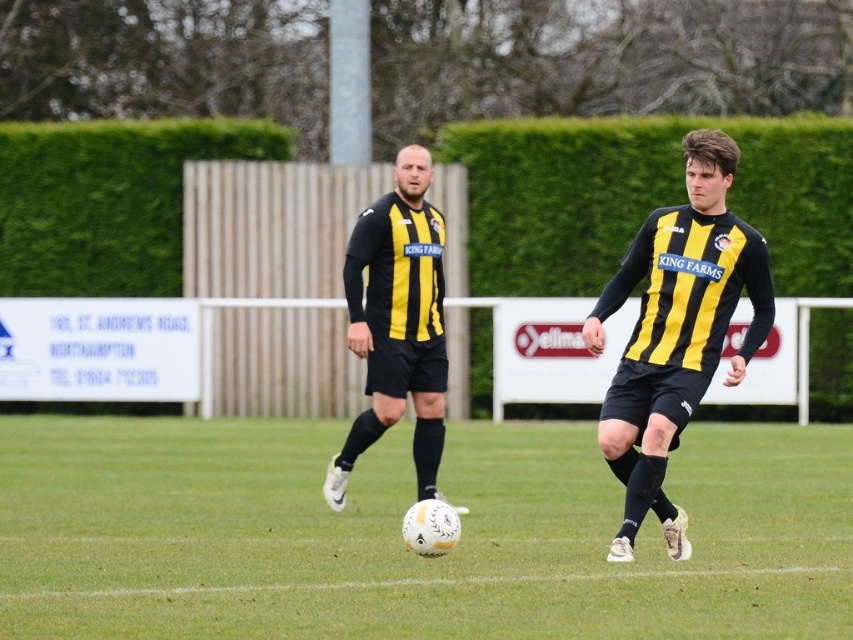
Does green grass football field at center appear under yellow matte jersey at center?

Yes, green grass football field at center is below yellow matte jersey at center.

Does point (848, 515) come behind point (624, 438)?

Yes, point (848, 515) is behind point (624, 438).

Where is `green grass football field at center`? The image size is (853, 640). green grass football field at center is located at coordinates (399, 536).

Which is more to the right, green leafy hedge at center or green leafy hedge at upper left?

green leafy hedge at center is more to the right.

Identify the location of green leafy hedge at center. The width and height of the screenshot is (853, 640). (643, 196).

Find the location of a particular element. yellow matte jersey at center is located at coordinates (676, 330).

Between yellow matte jersey at center and yellow/black striped jersey at center, which one appears on the right side from the viewer's perspective?

Positioned to the right is yellow matte jersey at center.

Where is `yellow matte jersey at center`? The width and height of the screenshot is (853, 640). yellow matte jersey at center is located at coordinates (676, 330).

Identify the location of yellow matte jersey at center. The image size is (853, 640). (676, 330).